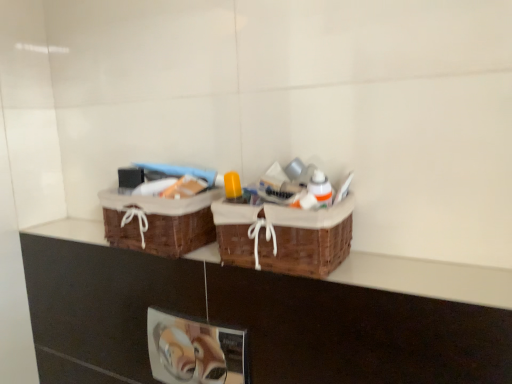
Question: Is brown woven picnic basket at center, which is the first picnic basket in left-to-right order, inside woven brown picnic basket at center, the 2th picnic basket positioned from the left?

Choices:
 (A) yes
 (B) no

Answer: (B)

Question: Is woven brown picnic basket at center, the first picnic basket when ordered from right to left, thinner than brown woven picnic basket at center, which is the first picnic basket in left-to-right order?

Choices:
 (A) yes
 (B) no

Answer: (B)

Question: Considering the relative sizes of woven brown picnic basket at center, the first picnic basket when ordered from right to left, and brown woven picnic basket at center, positioned as the second picnic basket in right-to-left order, in the image provided, is woven brown picnic basket at center, the first picnic basket when ordered from right to left, taller than brown woven picnic basket at center, positioned as the second picnic basket in right-to-left order,?

Choices:
 (A) yes
 (B) no

Answer: (A)

Question: Are woven brown picnic basket at center, the first picnic basket when ordered from right to left, and brown woven picnic basket at center, which is the first picnic basket in left-to-right order, beside each other?

Choices:
 (A) no
 (B) yes

Answer: (A)

Question: Is woven brown picnic basket at center, the 2th picnic basket positioned from the left, at the left side of brown woven picnic basket at center, which is the first picnic basket in left-to-right order?

Choices:
 (A) yes
 (B) no

Answer: (B)

Question: Is woven brown picnic basket at center, the first picnic basket when ordered from right to left, positioned with its back to brown woven picnic basket at center, positioned as the second picnic basket in right-to-left order?

Choices:
 (A) no
 (B) yes

Answer: (A)

Question: Can you confirm if brown woven picnic basket at center, which is the first picnic basket in left-to-right order, is thinner than brown woven baskets at upper center?

Choices:
 (A) yes
 (B) no

Answer: (B)

Question: Does brown woven picnic basket at center, which is the first picnic basket in left-to-right order, contain brown woven baskets at upper center?

Choices:
 (A) yes
 (B) no

Answer: (B)

Question: From a real-world perspective, is brown woven picnic basket at center, positioned as the second picnic basket in right-to-left order, over brown woven baskets at upper center?

Choices:
 (A) yes
 (B) no

Answer: (A)

Question: From the image's perspective, is brown woven picnic basket at center, positioned as the second picnic basket in right-to-left order, over brown woven baskets at upper center?

Choices:
 (A) no
 (B) yes

Answer: (B)

Question: Is brown woven picnic basket at center, which is the first picnic basket in left-to-right order, next to brown woven baskets at upper center?

Choices:
 (A) yes
 (B) no

Answer: (B)

Question: Is brown woven picnic basket at center, positioned as the second picnic basket in right-to-left order, oriented away from brown woven baskets at upper center?

Choices:
 (A) no
 (B) yes

Answer: (A)

Question: From the image's perspective, is woven brown picnic basket at center, the 2th picnic basket positioned from the left, under brown woven baskets at upper center?

Choices:
 (A) no
 (B) yes

Answer: (A)